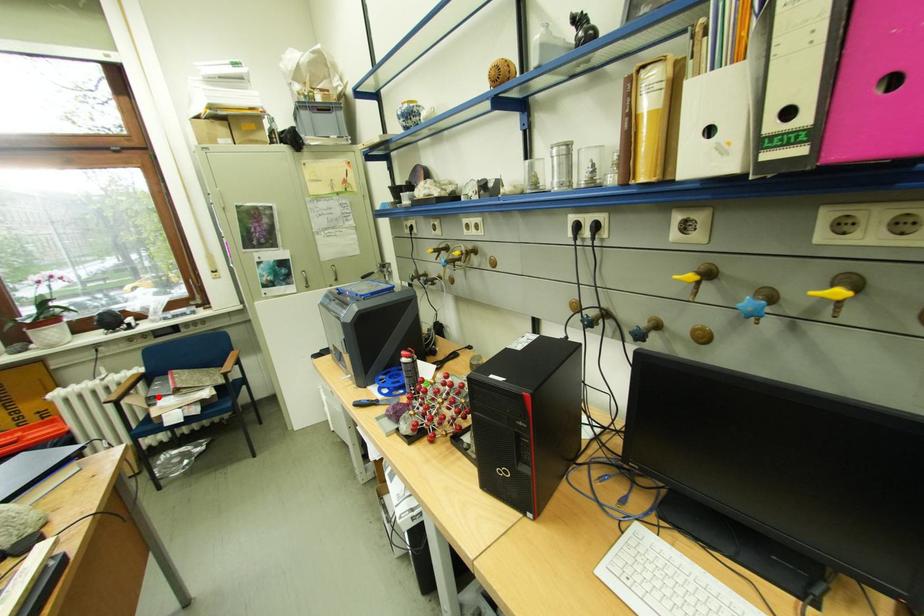
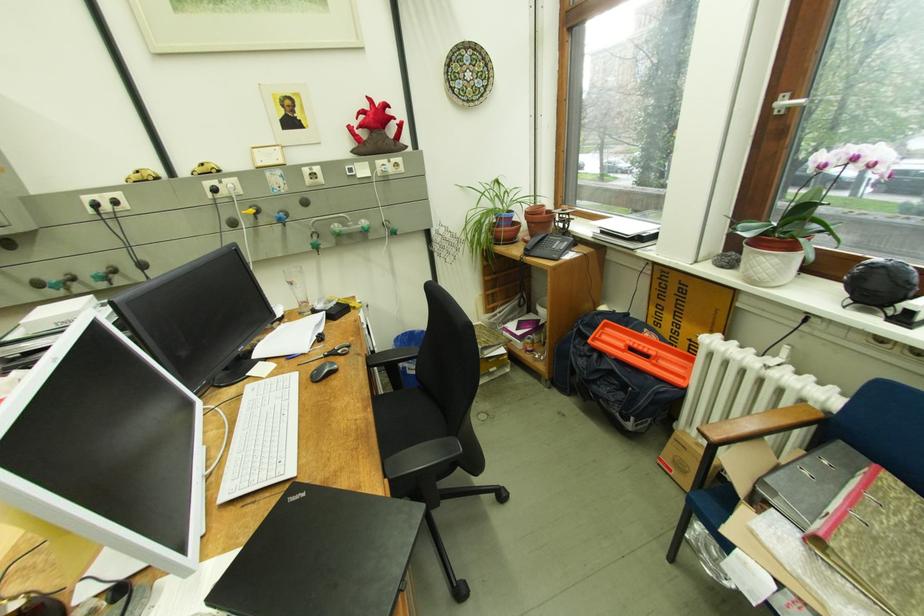
In the second image, find the point that corresponds to the highlighted location in the first image.

(777, 482)